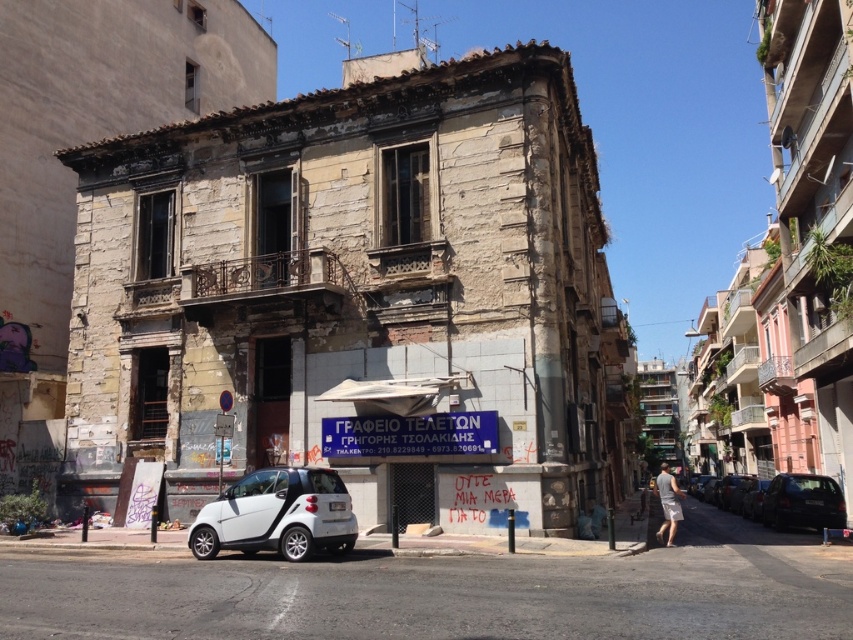
You are a pedestrian standing on the sidewalk in front of the weathered building. You see a white matte car at center and a dark gray metallic car at right. Which car is nearer to you?

The white matte car at center is closer to the viewer than the dark gray metallic car at right, so the white matte car at center is nearer to you.

You are standing in front of the building and want to take a photo that includes both the point at coordinate point (x=320, y=470) and the point at coordinate point (x=825, y=484). Which point will appear larger in the photo?

Point (x=320, y=470) will appear larger in the photo because it is closer to the camera than point (x=825, y=484).